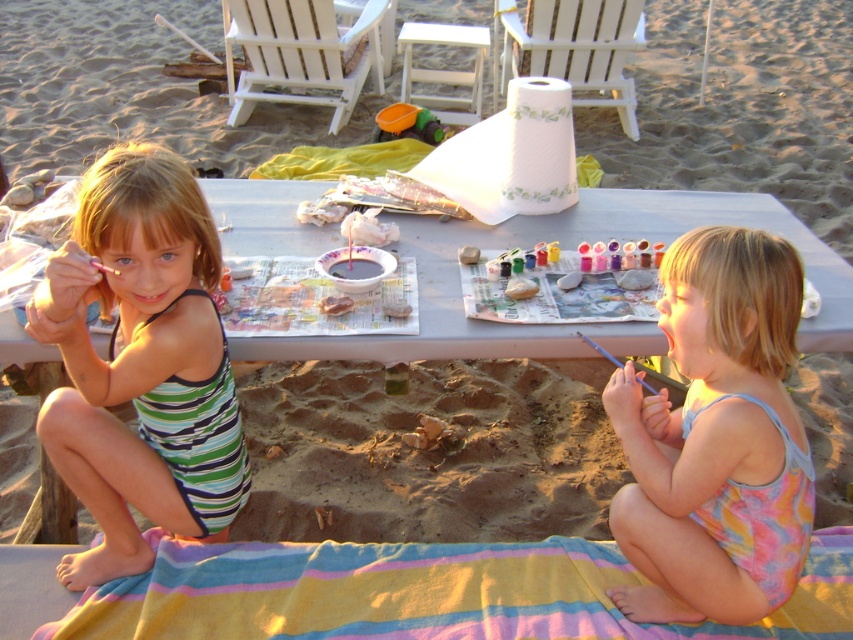
In the scene shown: You are a photographer trying to capture a candid shot of the striped fabric swimsuit at left and the blue plastic paint brush at lower right. Since you want to focus on both objects, which one should you adjust your camera focus on first to ensure both are in the frame?

The striped fabric swimsuit at left is in front of the blue plastic paint brush at lower right, so you should focus on the striped fabric swimsuit at left first to ensure both are in the frame.